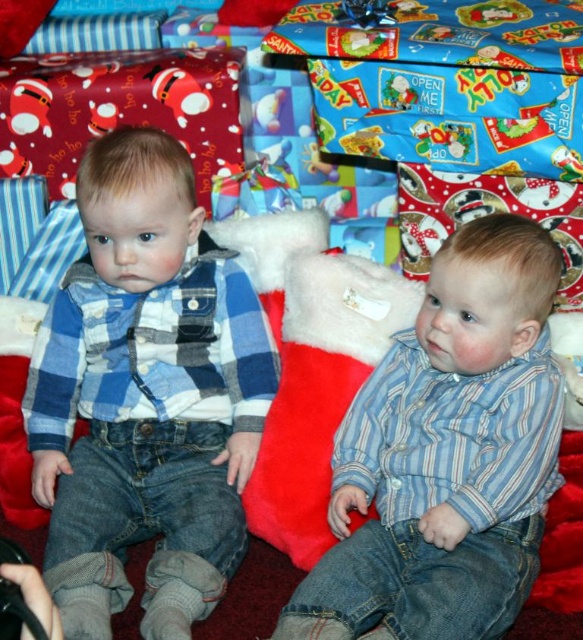
Which is below, blue plaid shirt at left or blue striped shirt at center?

blue striped shirt at center is lower down.

Between blue plaid shirt at left and blue striped shirt at center, which one is positioned higher?

blue plaid shirt at left is above.

Where is `blue plaid shirt at left`? The height and width of the screenshot is (640, 583). blue plaid shirt at left is located at coordinates (145, 396).